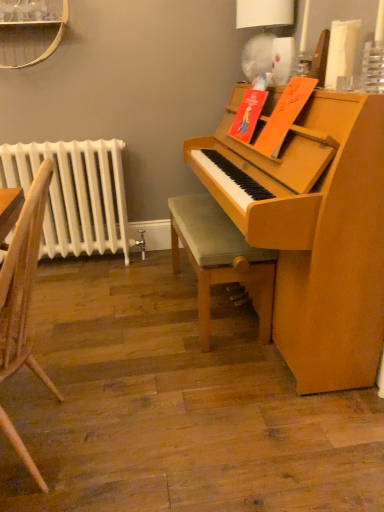
Question: Is white paper lampshade at upper right taller than wooden chair at left?

Choices:
 (A) no
 (B) yes

Answer: (A)

Question: Does white paper lampshade at upper right come behind wooden chair at left?

Choices:
 (A) yes
 (B) no

Answer: (A)

Question: From a real-world perspective, is white paper lampshade at upper right on top of wooden chair at left?

Choices:
 (A) no
 (B) yes

Answer: (B)

Question: Can wooden chair at left be found inside white paper lampshade at upper right?

Choices:
 (A) yes
 (B) no

Answer: (B)

Question: From the image's perspective, does white paper lampshade at upper right appear higher than wooden chair at left?

Choices:
 (A) yes
 (B) no

Answer: (A)

Question: Which is correct: white paper lampshade at upper right is inside wooden chair at left, or outside of it?

Choices:
 (A) outside
 (B) inside

Answer: (A)

Question: Is white paper lampshade at upper right bigger or smaller than wooden chair at left?

Choices:
 (A) big
 (B) small

Answer: (B)

Question: Considering their positions, is white paper lampshade at upper right located in front of or behind wooden chair at left?

Choices:
 (A) front
 (B) behind

Answer: (B)

Question: In the image, is white paper lampshade at upper right on the left side or the right side of wooden chair at left?

Choices:
 (A) right
 (B) left

Answer: (A)

Question: From the image's perspective, relative to wooden chair at left, is white painted metal radiator at left above or below?

Choices:
 (A) above
 (B) below

Answer: (A)

Question: Is white painted metal radiator at left wider or thinner than wooden chair at left?

Choices:
 (A) wide
 (B) thin

Answer: (B)

Question: Based on their sizes in the image, would you say white painted metal radiator at left is bigger or smaller than wooden chair at left?

Choices:
 (A) small
 (B) big

Answer: (A)

Question: Do you think white painted metal radiator at left is within wooden chair at left, or outside of it?

Choices:
 (A) inside
 (B) outside

Answer: (B)

Question: Choose the correct answer: Is white painted metal radiator at left inside white paper lampshade at upper right or outside it?

Choices:
 (A) inside
 (B) outside

Answer: (B)

Question: Is white painted metal radiator at left taller or shorter than white paper lampshade at upper right?

Choices:
 (A) tall
 (B) short

Answer: (A)